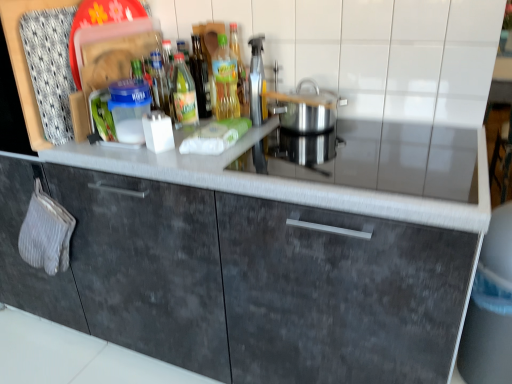
Question: Considering the positions of green glass bottle at center, which ranks as the second bottle in right-to-left order, and smooth gray countertop at center in the image, is green glass bottle at center, which ranks as the second bottle in right-to-left order, taller or shorter than smooth gray countertop at center?

Choices:
 (A) tall
 (B) short

Answer: (A)

Question: Looking at their shapes, would you say green glass bottle at center, the 1th bottle in the left-to-right sequence, is wider or thinner than smooth gray countertop at center?

Choices:
 (A) thin
 (B) wide

Answer: (A)

Question: Estimate the real-world distances between objects in this image. Which object is closer to the translucent plastic bottle at center, the 1th bottle when ordered from right to left?

Choices:
 (A) smooth gray countertop at center
 (B) dark gray matte cabinet at center
 (C) green glass bottle at center, which ranks as the second bottle in right-to-left order
 (D) silver metallic pot at center

Answer: (C)

Question: Estimate the real-world distances between objects in this image. Which object is closer to the green glass bottle at center, which ranks as the second bottle in right-to-left order?

Choices:
 (A) smooth gray countertop at center
 (B) silver metallic pot at center
 (C) dark gray matte cabinet at center
 (D) translucent plastic bottle at center, the second bottle when ordered from left to right

Answer: (D)